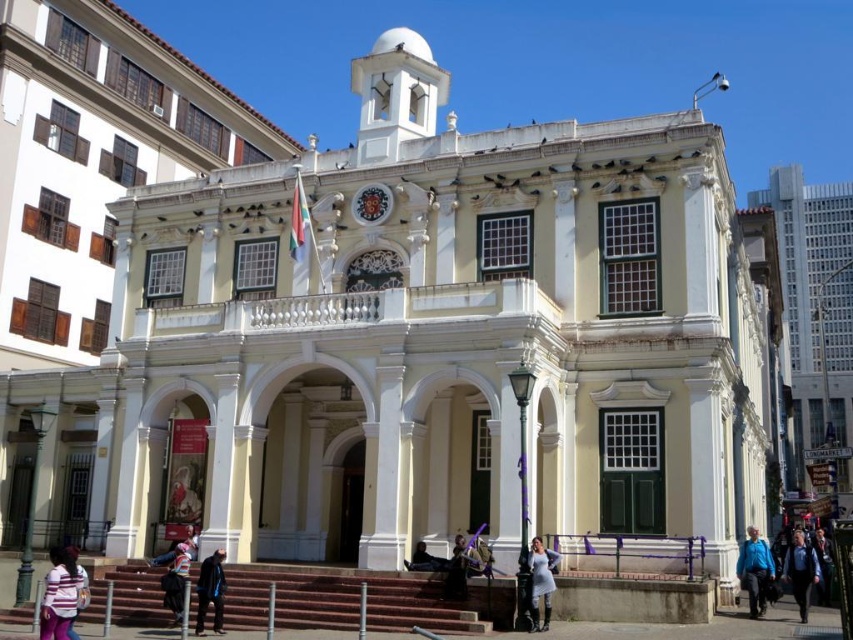
Between blue denim jacket at lower right and metallic clock face at center, which one has more height?

Standing taller between the two is blue denim jacket at lower right.

Who is more forward, (x=796, y=550) or (x=375, y=202)?

Point (x=796, y=550) is more forward.

Where is `blue denim jacket at lower right`? The image size is (853, 640). blue denim jacket at lower right is located at coordinates (799, 570).

Is striped sweater at lower left to the left of dark blue jacket at lower center from the viewer's perspective?

Indeed, striped sweater at lower left is positioned on the left side of dark blue jacket at lower center.

Who is higher up, striped sweater at lower left or dark blue jacket at lower center?

Positioned higher is dark blue jacket at lower center.

At what (x,y) coordinates should I click in order to perform the action: click on striped sweater at lower left. Please return your answer as a coordinate pair (x, y). Looking at the image, I should click on (59, 595).

The image size is (853, 640). What are the coordinates of `striped sweater at lower left` in the screenshot? It's located at (59, 595).

Does metallic clock face at center have a greater height compared to dark blue fabric coat at lower center?

Indeed, metallic clock face at center has a greater height compared to dark blue fabric coat at lower center.

Does metallic clock face at center have a lesser width compared to dark blue fabric coat at lower center?

In fact, metallic clock face at center might be wider than dark blue fabric coat at lower center.

Is point (355, 195) less distant than point (421, 541)?

No.

This screenshot has width=853, height=640. What are the coordinates of `metallic clock face at center` in the screenshot? It's located at (372, 204).